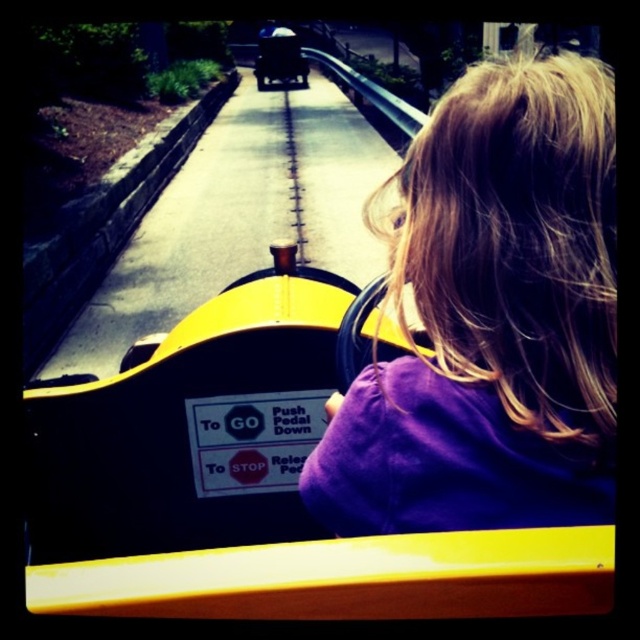
Between purple fabric hair at center and shiny black car at center, which one is positioned higher?

shiny black car at center

Which is more to the right, purple fabric hair at center or shiny black car at center?

purple fabric hair at center

Who is more distant from viewer, [545,232] or [282,76]?

Positioned behind is point [282,76].

Identify the location of purple fabric hair at center. Image resolution: width=640 pixels, height=640 pixels. (492, 317).